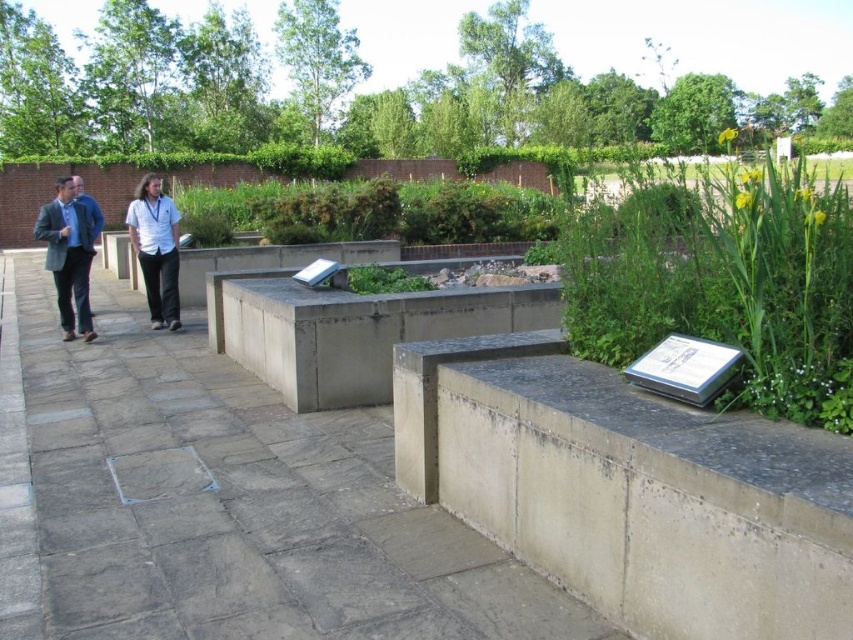
Question: Which object is farther from the camera taking this photo?

Choices:
 (A) matte black suit at left
 (B) green leafy plant at center
 (C) gray stone path at center
 (D) white shirt at center

Answer: (D)

Question: Can you confirm if green leafy plant at right is bigger than green leafy plant at center?

Choices:
 (A) no
 (B) yes

Answer: (B)

Question: Can you confirm if gray stone path at center is positioned to the left of white shirt at center?

Choices:
 (A) yes
 (B) no

Answer: (B)

Question: Which object appears closest to the camera in this image?

Choices:
 (A) matte black suit at left
 (B) green leafy plant at center

Answer: (B)

Question: Which point appears farthest from the camera in this image?

Choices:
 (A) (270, 632)
 (B) (641, 340)
 (C) (161, 282)

Answer: (C)

Question: Is gray stone path at center thinner than blue denim jacket at left?

Choices:
 (A) yes
 (B) no

Answer: (A)